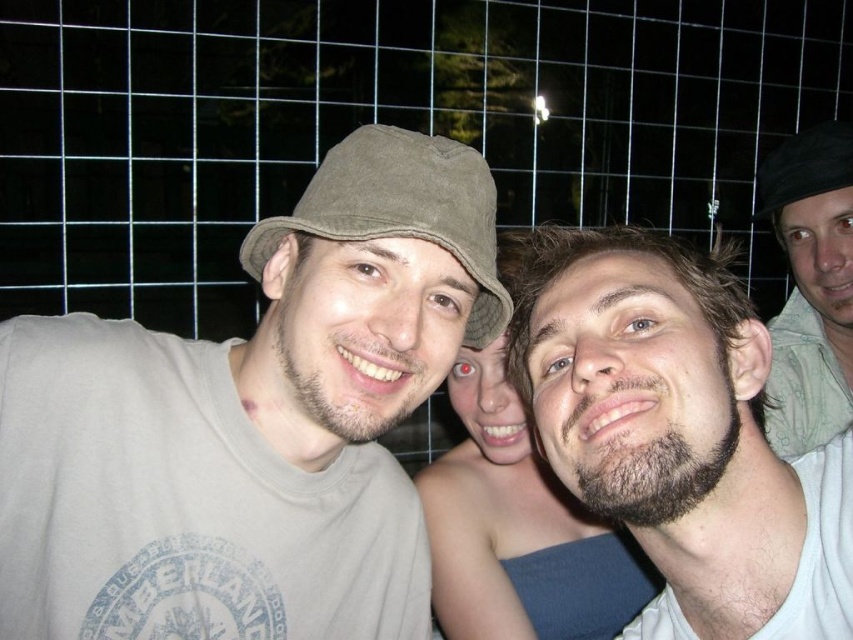
Can you confirm if matte khaki bucket hat at center is thinner than black fabric hat at upper right?

In fact, matte khaki bucket hat at center might be wider than black fabric hat at upper right.

Can you confirm if matte khaki bucket hat at center is wider than black fabric hat at upper right?

Correct, the width of matte khaki bucket hat at center exceeds that of black fabric hat at upper right.

Measure the distance between matte khaki bucket hat at center and camera.

matte khaki bucket hat at center and camera are 29.63 inches apart.

The image size is (853, 640). What are the coordinates of `matte khaki bucket hat at center` in the screenshot? It's located at (252, 422).

Between point (395, 164) and point (801, 154), which one is positioned behind?

The point (801, 154) is behind.

Is khaki fabric baseball cap at left wider than black fabric hat at upper right?

Correct, the width of khaki fabric baseball cap at left exceeds that of black fabric hat at upper right.

The image size is (853, 640). What do you see at coordinates (399, 209) in the screenshot?
I see `khaki fabric baseball cap at left` at bounding box center [399, 209].

I want to click on khaki fabric baseball cap at left, so click(399, 209).

Measure the distance between bearded man at center and smooth skin at center.

A distance of 25.92 centimeters exists between bearded man at center and smooth skin at center.

What do you see at coordinates (676, 429) in the screenshot? The image size is (853, 640). I see `bearded man at center` at bounding box center [676, 429].

Locate an element on the screen. bearded man at center is located at coordinates (676, 429).